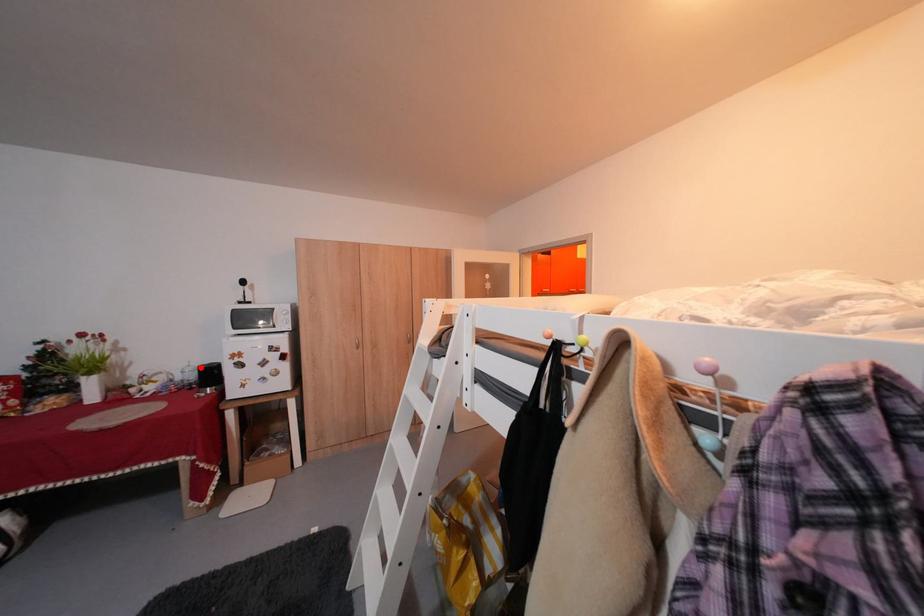
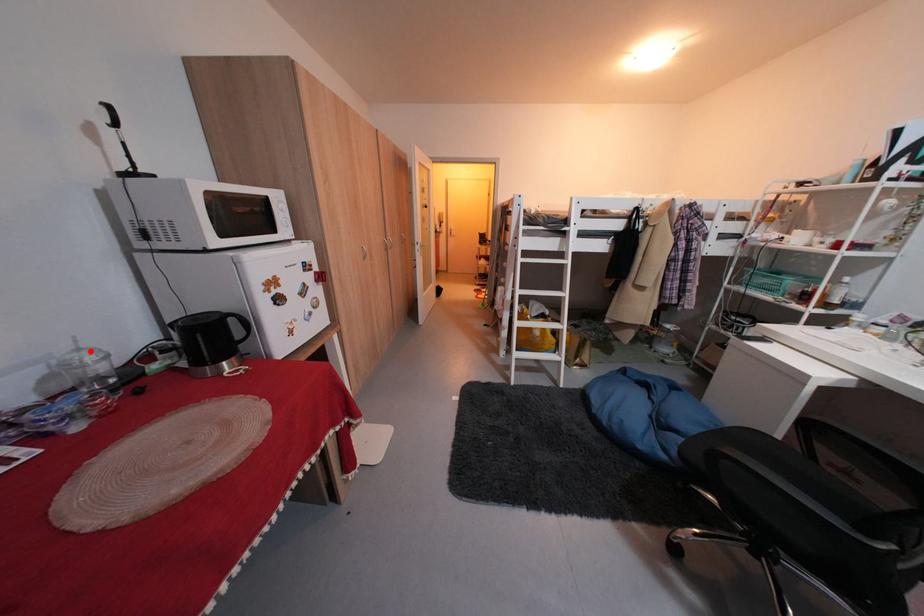
I am providing you with two images of the same scene from different viewpoints. A red point is marked on the first image and another point is marked on the second image. Is the red point in image1 aligned with the point shown in image2?

Yes